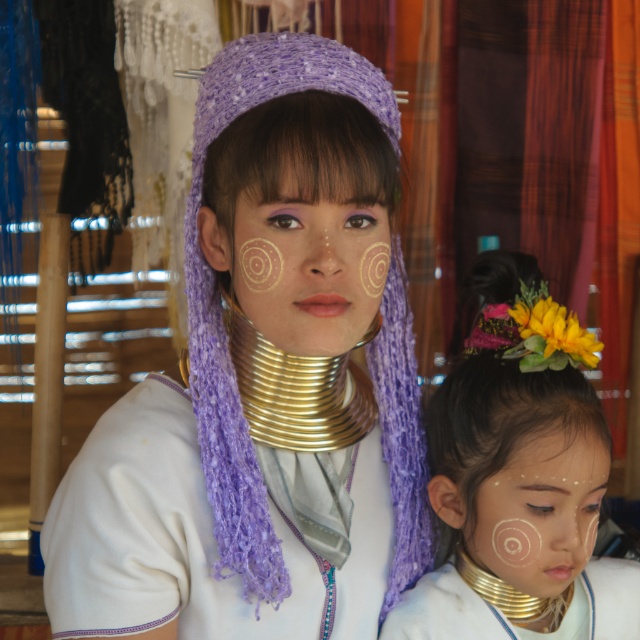
Looking at this image, is gold metallic neck rings at center taller than gold metallic neck piece at center?

Yes.

Does gold metallic neck rings at center have a lesser width compared to gold metallic neck piece at center?

Incorrect, gold metallic neck rings at center's width is not less than gold metallic neck piece at center's.

You are a GUI agent. You are given a task and a screenshot of the screen. Output one action in this format:
    pyautogui.click(x=<x>, y=<y>)
    Task: Click on the gold metallic neck rings at center
    
    Given the screenshot: What is the action you would take?
    pyautogui.click(x=144, y=531)

Locate an element on the screen. gold metallic neck rings at center is located at coordinates (144, 531).

Which is behind, point (106, 545) or point (276, 273)?

The point (106, 545) is more distant.

Can you confirm if gold metallic neck rings at center is positioned above gold metallic face paint at center?

Incorrect, gold metallic neck rings at center is not positioned above gold metallic face paint at center.

Is point (128, 412) in front of point (285, 256)?

No, it is behind (285, 256).

Locate an element on the screen. Image resolution: width=640 pixels, height=640 pixels. gold metallic neck rings at center is located at coordinates (144, 531).

Is white matte face paint at center positioned behind gold metallic neck rings at center?

Yes, it is behind gold metallic neck rings at center.

Who is shorter, white matte face paint at center or gold metallic neck rings at center?

gold metallic neck rings at center

Does point (472, 330) come closer to viewer compared to point (292, 579)?

No, (472, 330) is behind (292, 579).

The width and height of the screenshot is (640, 640). Identify the location of white matte face paint at center. (518, 483).